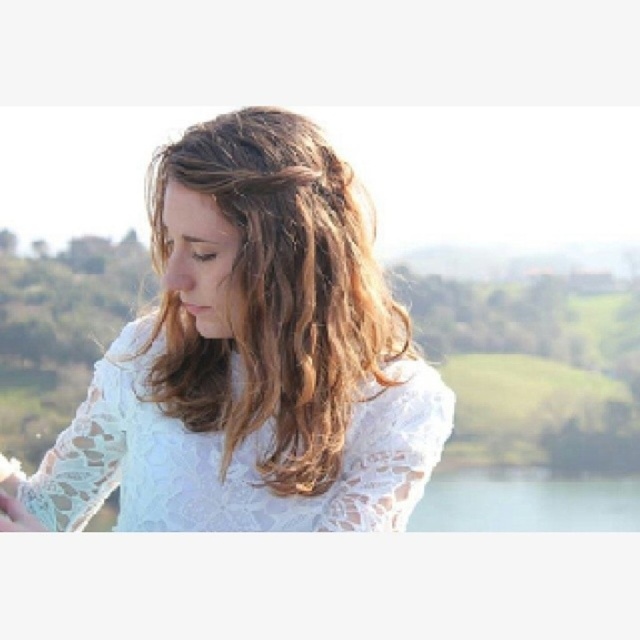
Does white lace shirt at center have a lesser height compared to white lace dress at center?

No.

Between white lace shirt at center and white lace dress at center, which one appears on the left side from the viewer's perspective?

Positioned to the left is white lace shirt at center.

Is point (161, 280) positioned in front of point (380, 408)?

No.

Find the location of `white lace shirt at center`. white lace shirt at center is located at coordinates coord(250,358).

Between point (147, 465) and point (576, 500), which one is positioned behind?

The point (576, 500) is more distant.

Is white lace shirt at center shorter than transparent glass lake at bottom?

Incorrect, white lace shirt at center's height does not fall short of transparent glass lake at bottom's.

Between point (268, 490) and point (499, 516), which one is positioned in front?

Point (268, 490) is more forward.

Where is `white lace shirt at center`? white lace shirt at center is located at coordinates (250, 358).

Does white lace dress at center appear over transparent glass lake at bottom?

Yes, white lace dress at center is above transparent glass lake at bottom.

You are a GUI agent. You are given a task and a screenshot of the screen. Output one action in this format:
    pyautogui.click(x=<x>, y=<y>)
    Task: Click on the white lace dress at center
    This screenshot has width=640, height=640.
    Given the screenshot: What is the action you would take?
    pyautogui.click(x=232, y=456)